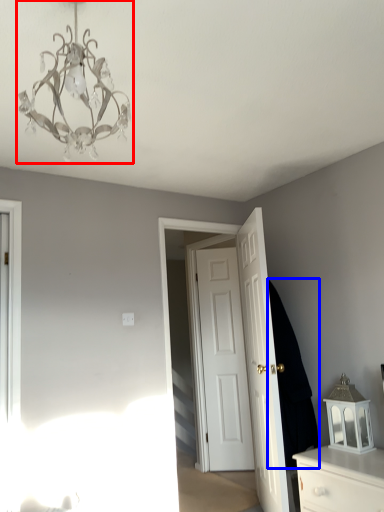
Question: Which object is further to the camera taking this photo, lamp (highlighted by a red box) or dark (highlighted by a blue box)?

Choices:
 (A) lamp
 (B) dark

Answer: (B)